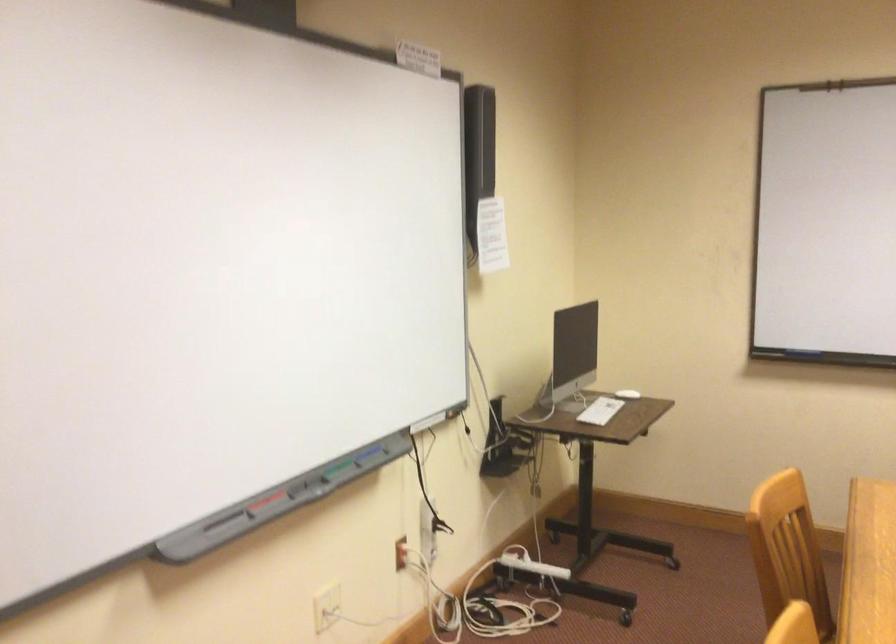
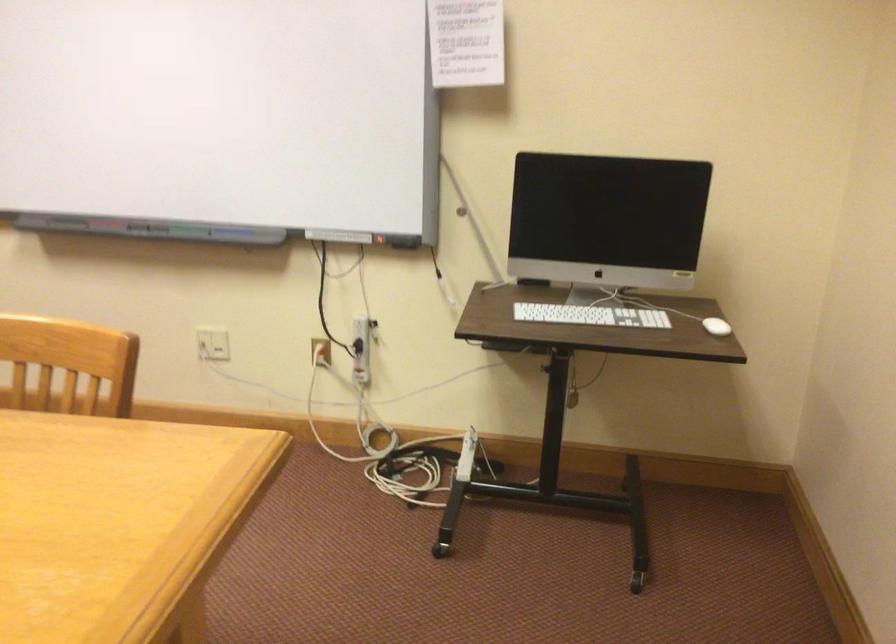
In the second image, find the point that corresponds to (x=643, y=390) in the first image.

(716, 326)